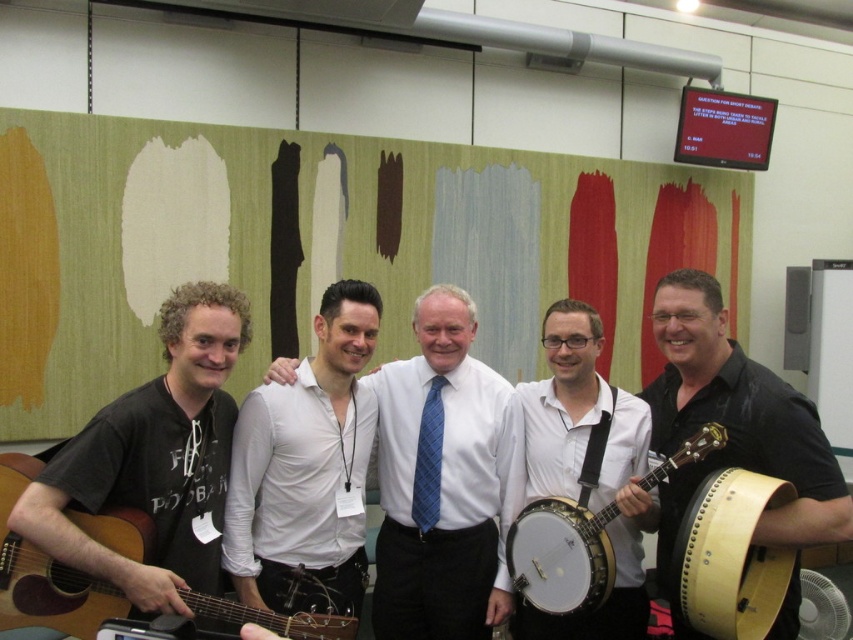
Question: Is white smooth shirt at center smaller than black leather banjo at center?

Choices:
 (A) no
 (B) yes

Answer: (B)

Question: Which point appears closest to the camera in this image?

Choices:
 (A) (415, 518)
 (B) (440, 534)
 (C) (103, 413)

Answer: (C)

Question: Which point appears closest to the camera in this image?

Choices:
 (A) (587, 595)
 (B) (28, 458)
 (C) (222, 339)

Answer: (C)

Question: Does black leather banjo at center appear over wooden drum at right?

Choices:
 (A) no
 (B) yes

Answer: (B)

Question: Which point is closer to the camera?

Choices:
 (A) (273, 432)
 (B) (642, 452)

Answer: (A)

Question: In this image, where is white smooth shirt at center located relative to black leather banjo at center?

Choices:
 (A) right
 (B) left

Answer: (B)